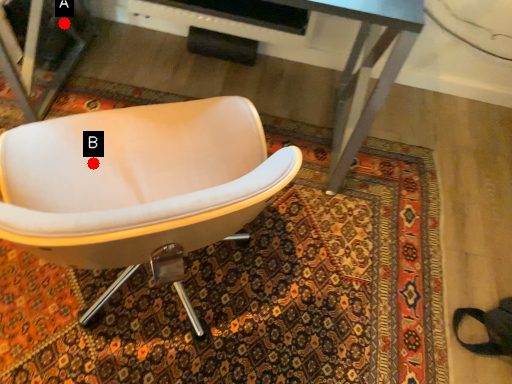
Question: Two points are circled on the image, labeled by A and B beside each circle. Which point is closer to the camera?

Choices:
 (A) A is closer
 (B) B is closer

Answer: (B)